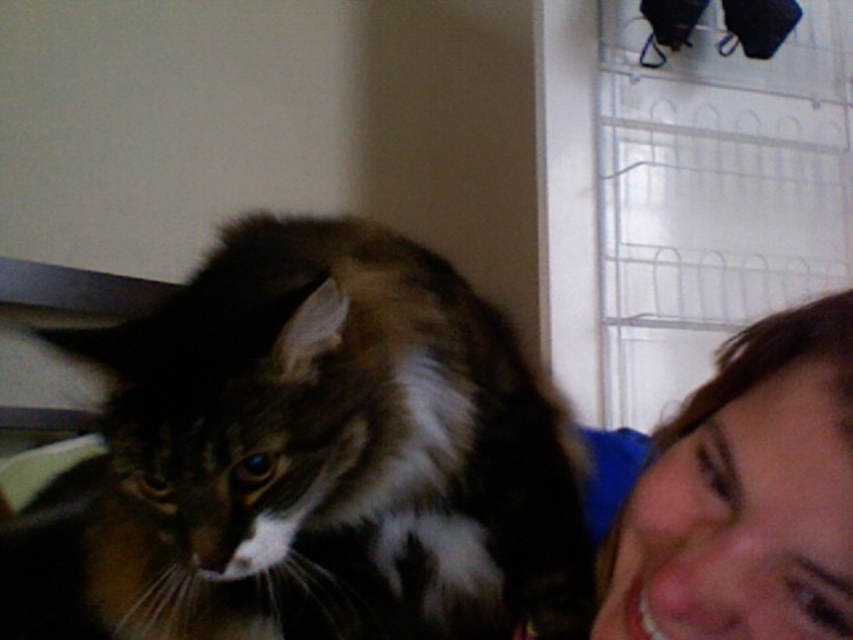
You are a photographer trying to capture a portrait of both the fuzzy brown cat at left and the smooth skin face at lower right in the same frame. Based on their positions, which subject is closer to the left edge of the frame?

The fuzzy brown cat at left is positioned to the left of the smooth skin face at lower right, so the fuzzy brown cat at left is closer to the left edge of the frame.

You are holding a 75 cm long measuring tape and want to measure the distance from your current position to the point at coordinates point (544,440). Can you reach that point with your measuring tape?

The distance of point (544,440) from camera is 79.93 centimeters. Since the measuring tape is 75 cm long, it is shorter than the required distance. You cannot reach the point with the measuring tape.